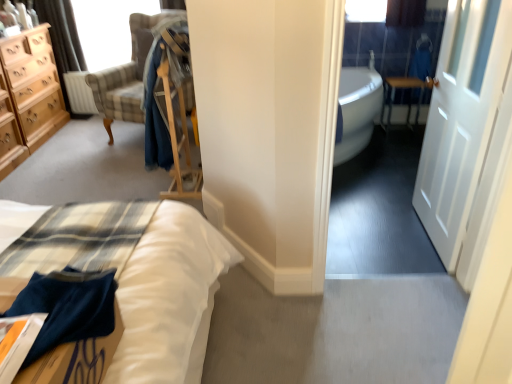
Question: Is metallic silver table at right at the back of matte beige curtain at upper left?

Choices:
 (A) no
 (B) yes

Answer: (A)

Question: Can you confirm if matte beige curtain at upper left is bigger than metallic silver table at right?

Choices:
 (A) no
 (B) yes

Answer: (B)

Question: Would you say matte beige curtain at upper left contains metallic silver table at right?

Choices:
 (A) no
 (B) yes

Answer: (A)

Question: Considering the relative positions of matte beige curtain at upper left and metallic silver table at right in the image provided, is matte beige curtain at upper left to the left of metallic silver table at right from the viewer's perspective?

Choices:
 (A) no
 (B) yes

Answer: (B)

Question: Is the position of matte beige curtain at upper left less distant than that of metallic silver table at right?

Choices:
 (A) yes
 (B) no

Answer: (A)

Question: Choose the correct answer: Is metallic silver table at right inside blue cotton robe at center or outside it?

Choices:
 (A) inside
 (B) outside

Answer: (B)

Question: In terms of width, does metallic silver table at right look wider or thinner when compared to blue cotton robe at center?

Choices:
 (A) wide
 (B) thin

Answer: (B)

Question: Is point click(x=415, y=82) positioned closer to the camera than point click(x=169, y=165)?

Choices:
 (A) farther
 (B) closer

Answer: (A)

Question: Is metallic silver table at right taller or shorter than blue cotton robe at center?

Choices:
 (A) tall
 (B) short

Answer: (B)

Question: From the image's perspective, is plaid fabric chair at upper left above or below clear glass window screen at upper left?

Choices:
 (A) above
 (B) below

Answer: (B)

Question: Choose the correct answer: Is plaid fabric chair at upper left inside clear glass window screen at upper left or outside it?

Choices:
 (A) inside
 (B) outside

Answer: (B)

Question: Is plaid fabric chair at upper left wider or thinner than clear glass window screen at upper left?

Choices:
 (A) thin
 (B) wide

Answer: (B)

Question: From a real-world perspective, relative to clear glass window screen at upper left, is plaid fabric chair at upper left vertically above or below?

Choices:
 (A) above
 (B) below

Answer: (B)

Question: From a real-world perspective, relative to metallic silver table at right, is clear glass window screen at upper left vertically above or below?

Choices:
 (A) below
 (B) above

Answer: (B)

Question: Considering the positions of point (93, 11) and point (415, 110), is point (93, 11) closer or farther from the camera than point (415, 110)?

Choices:
 (A) closer
 (B) farther

Answer: (A)